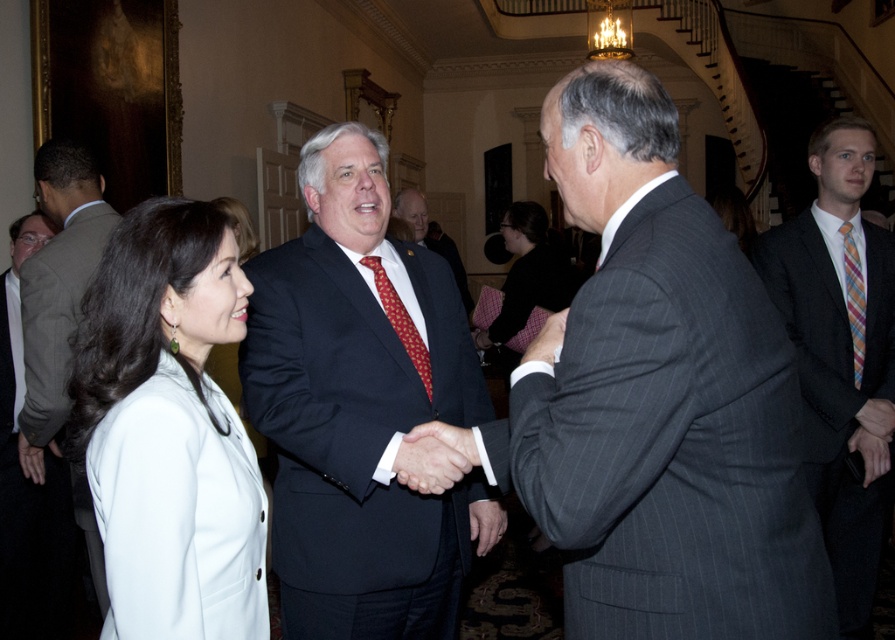
You are at a formal event and need to locate two attendees wearing specific attire. The white fabric coat at left and the black fabric dress at center are part of the crowd. Based on their positions, which clothing item is positioned more to the left side of the scene?

The white fabric coat at left is positioned more to the left side of the scene compared to the black fabric dress at center.

You are an event planner arranging seating for a dinner. You need to place a name tag for the person in the light brown suit at left and another for the person with the red silk tie at center. Based on their positions in the image, which name tag should be placed closer to the front of the table?

The light brown suit at left is positioned under the red silk tie at center, meaning the person in the light brown suit at left is closer to the front of the table. Therefore, their name tag should be placed closer to the front.

Consider the image. You are attending this event and want to know which clothing item is shorter between the white fabric coat at left and the black fabric dress at center. Can you determine this?

The white fabric coat at left is shorter than the black fabric dress at center.